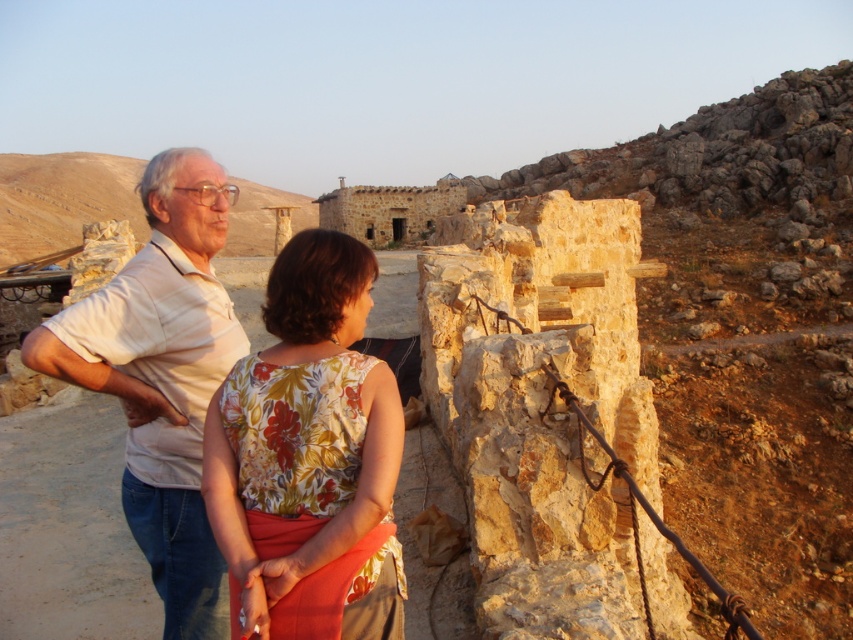
You are a photographer planning to take a group photo of the two people in the scene. The camera you are using has a maximum width capacity of 1.2 meters. Given the floral fabric blouse at center and the light beige cotton shirt at left, will both individuals fit within the camera frame if positioned side by side?

The floral fabric blouse at center is less wide than the light beige cotton shirt at left. Since the total width of both would be the sum of their individual widths, but the exact combined width isn

In the scene described, where is the floral fabric blouse at center in relation to the light beige cotton shirt at left?

The floral fabric blouse at center is to the right of the light beige cotton shirt at left according to the description.

You are a photographer trying to capture a photo of both the floral fabric blouse at center and the light beige cotton shirt at left. Which clothing item should you focus on first if you want to ensure both are in frame without moving the camera?

The floral fabric blouse at center is shorter than the light beige cotton shirt at left, so you should focus on the light beige cotton shirt at left first to ensure both are in frame without moving the camera.